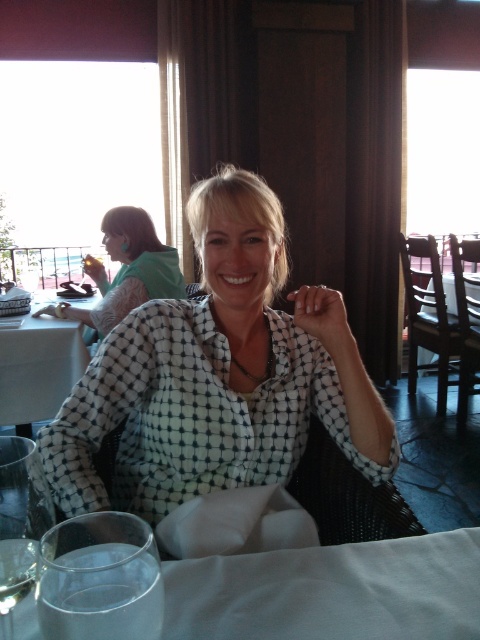
Question: Estimate the real-world distances between objects in this image. Which object is farther from the white glossy table at left?

Choices:
 (A) clear glass wine glass at lower left
 (B) transparent glass at lower left
 (C) matte green dress at upper left

Answer: (B)

Question: Which point is farther to the camera?

Choices:
 (A) transparent glass at lower left
 (B) matte black plate at upper left

Answer: (B)

Question: Does clear glass wine glass at lower left appear under matte green plate at upper left?

Choices:
 (A) no
 (B) yes

Answer: (B)

Question: Can you confirm if transparent glass at lower left is bigger than matte black plate at upper left?

Choices:
 (A) no
 (B) yes

Answer: (B)

Question: Which point appears closest to the camera in this image?

Choices:
 (A) (47, 308)
 (B) (17, 577)
 (C) (155, 248)

Answer: (B)

Question: Is matte black phone at lower left further to camera compared to matte black plate at upper left?

Choices:
 (A) yes
 (B) no

Answer: (A)